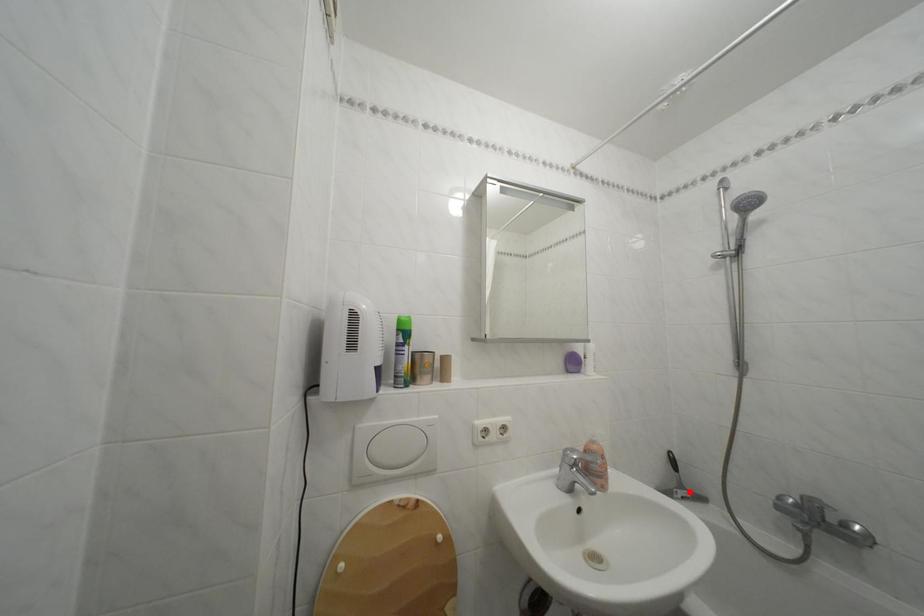
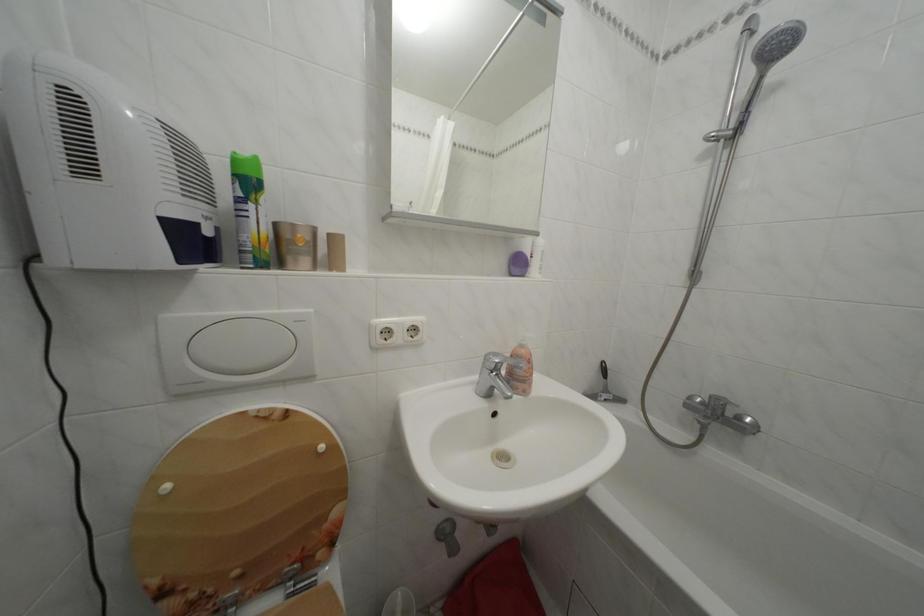
Where in the second image is the point corresponding to the highlighted location from the first image?

(614, 397)